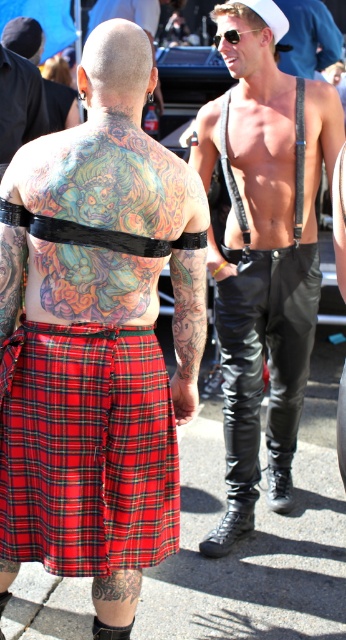
From the picture: You are a photographer at an event and want to capture both the shiny leather pants at right and the shiny black leather pants at center in a single frame. Which pair of pants should you focus on first to ensure they are in focus, considering their height differences?

The shiny leather pants at right has a lesser height compared to the shiny black leather pants at center, so you should focus on the shiny black leather pants at center first as they are taller and might be more prominent in the frame.

You are a photographer at an event and need to position two subjects for a photo. The subjects are wearing shiny leather pants at right and shiny black leather pants at center. Based on their current positions, which subject should you move to the right to create symmetry between them?

The shiny leather pants at right should be moved to the right to align with the shiny black leather pants at center since the shiny leather pants at right is currently on the left side of the shiny black leather pants at center.